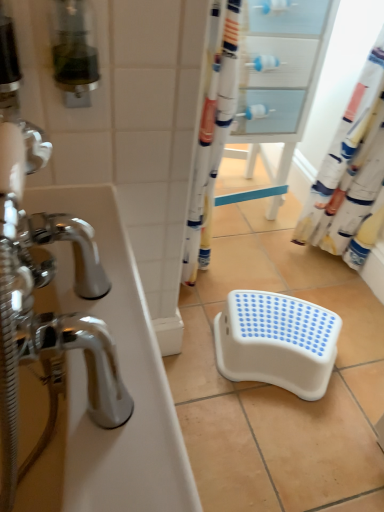
I want to click on vacant area located to the right-hand side of white plastic step stool at center, so click(361, 356).